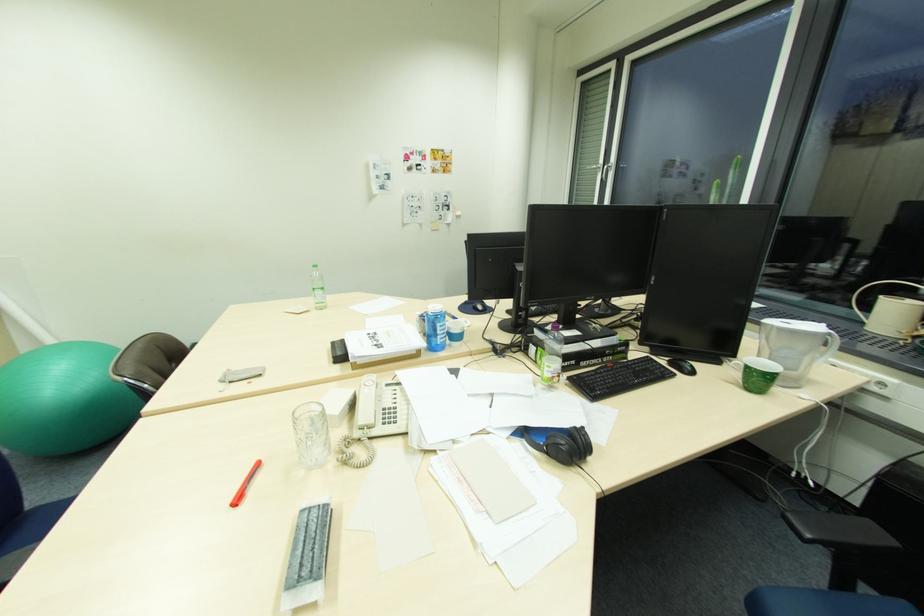
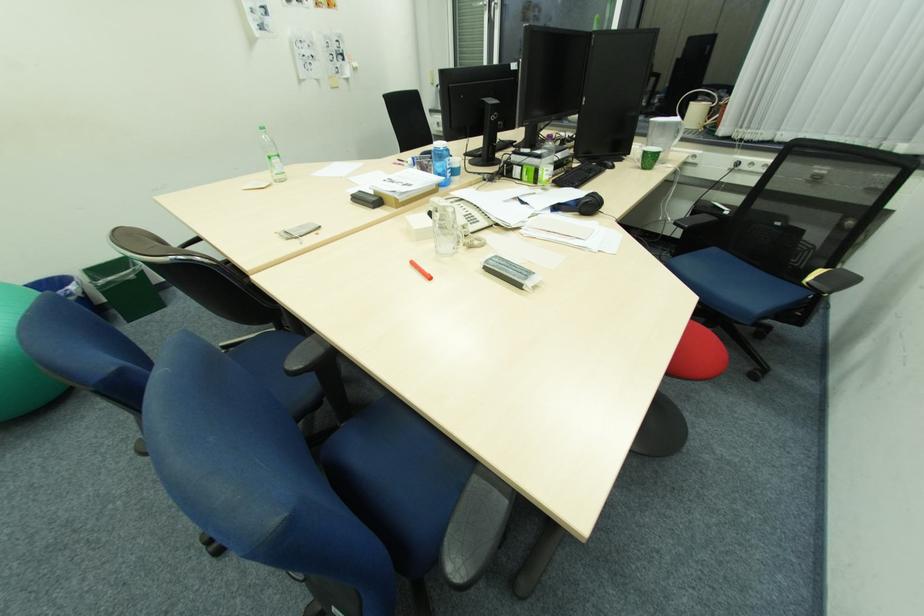
Find the pixel in the second image that matches (348,341) in the first image.

(366, 192)